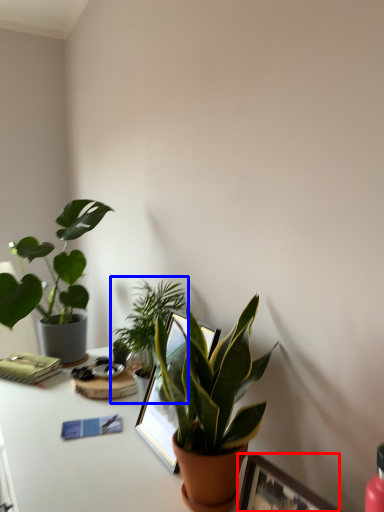
Question: Which object is closer to the camera taking this photo, picture frame (highlighted by a red box) or houseplant (highlighted by a blue box)?

Choices:
 (A) picture frame
 (B) houseplant

Answer: (A)